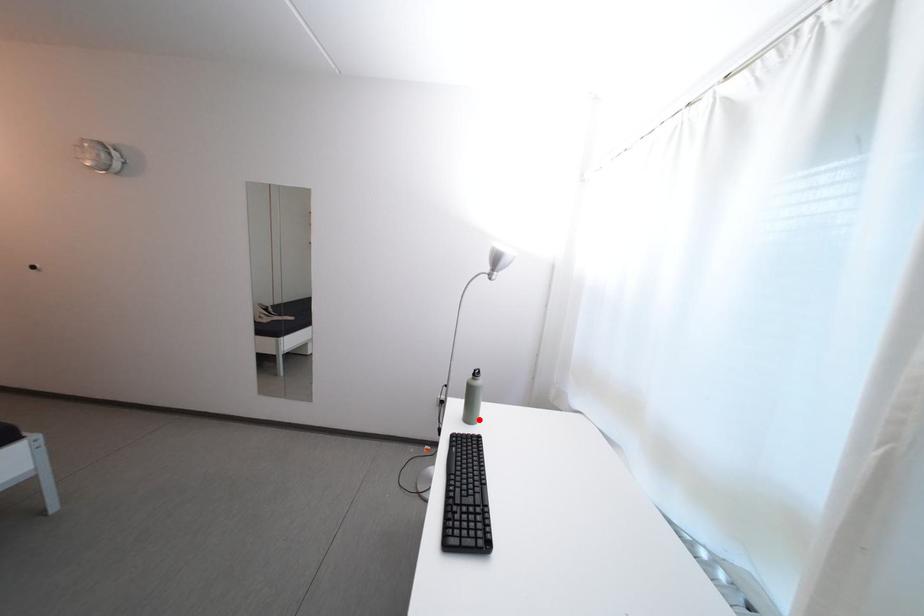
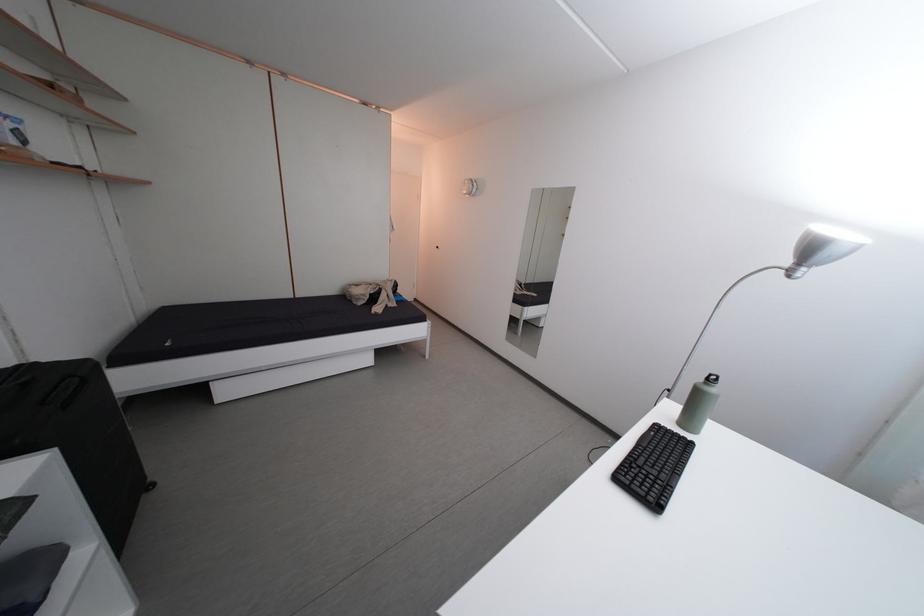
Question: A red point is marked in image1. In image2, is the corresponding 3D point closer to the camera or farther? Reply with the corresponding letter.

Choices:
 (A) The corresponding 3D point is closer.
 (B) The corresponding 3D point is farther.

Answer: (A)